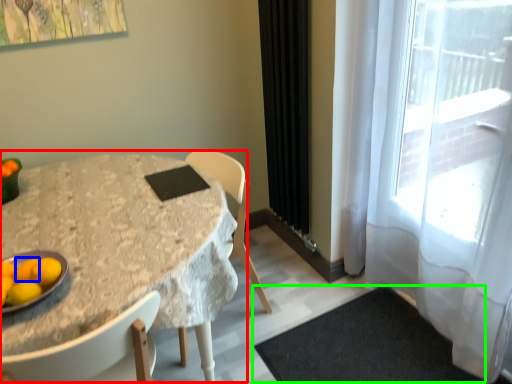
Question: Based on their relative distances, which object is nearer to table (highlighted by a red box)? Choose from tangerine (highlighted by a blue box) and doormat (highlighted by a green box).

Choices:
 (A) tangerine
 (B) doormat

Answer: (A)